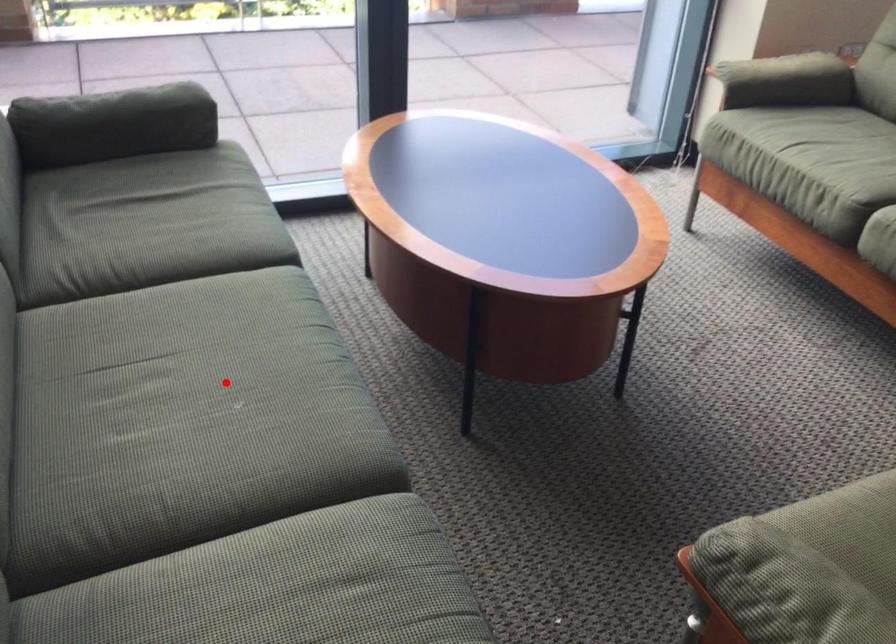
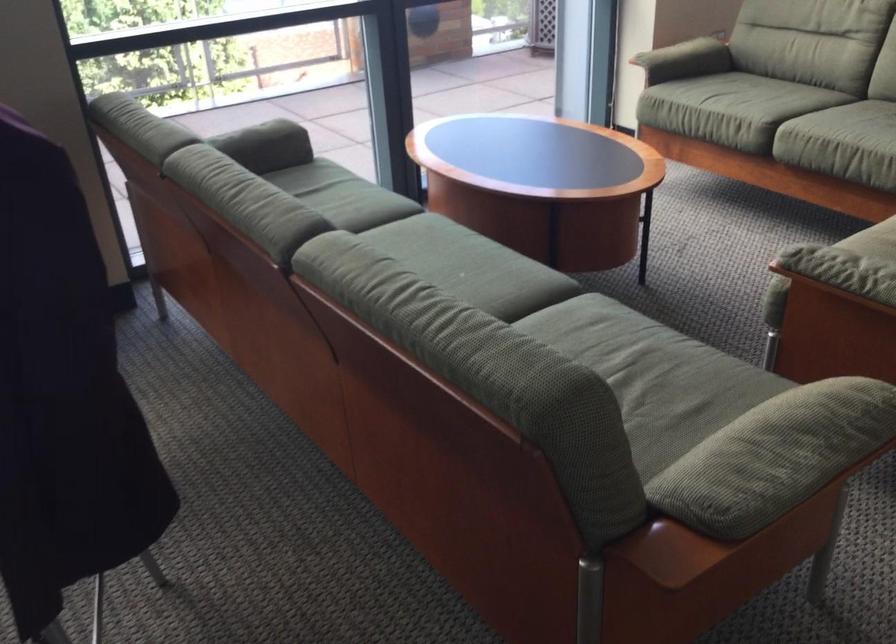
Question: I am providing you with two images of the same scene from different viewpoints. Image1 has a red point marked. In image2, the corresponding 3D location appears at what relative position? Reply with the corresponding letter.

Choices:
 (A) Closer
 (B) Farther

Answer: (B)